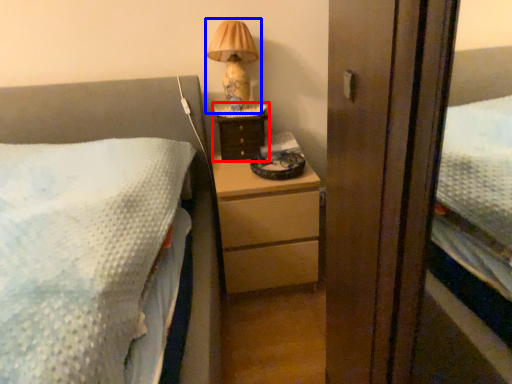
Question: Which of the following is the farthest to the observer, nightstand (highlighted by a red box) or table lamp (highlighted by a blue box)?

Choices:
 (A) nightstand
 (B) table lamp

Answer: (A)